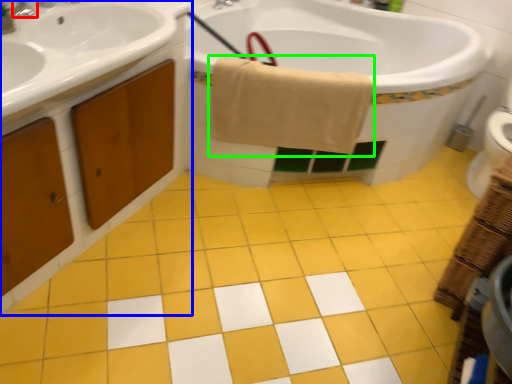
Question: Which is farther away from tap (highlighted by a red box)? bathroom cabinet (highlighted by a blue box) or bath towel (highlighted by a green box)?

Choices:
 (A) bathroom cabinet
 (B) bath towel

Answer: (B)